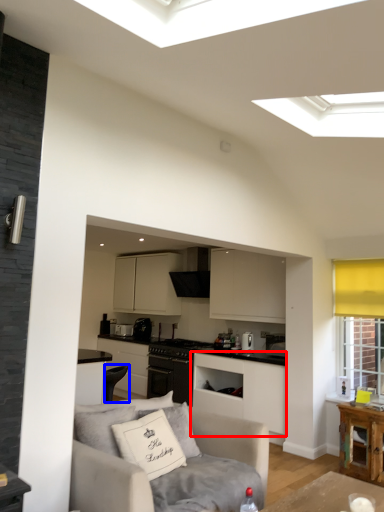
Question: Which object is closer to the camera taking this photo, cabinetry (highlighted by a red box) or armchair (highlighted by a blue box)?

Choices:
 (A) cabinetry
 (B) armchair

Answer: (A)